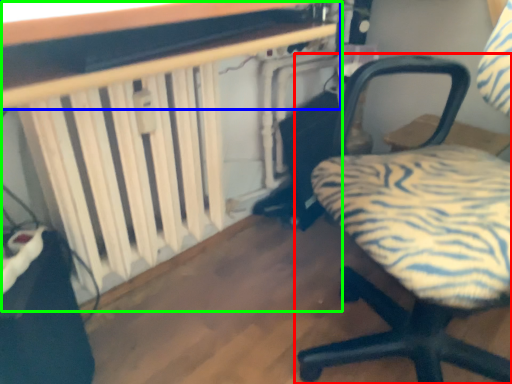
Question: Which object is positioned closest to chair (highlighted by a red box)? Select from table (highlighted by a blue box) and table (highlighted by a green box).

Choices:
 (A) table
 (B) table

Answer: (B)